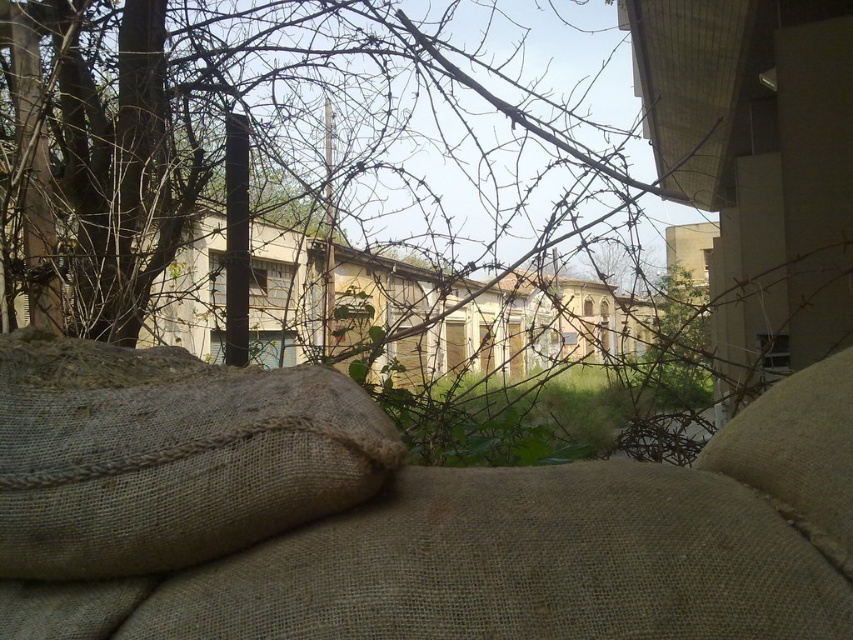
Is point (149, 81) behind point (44, 497)?

Yes, point (149, 81) is behind point (44, 497).

Between brown rough tree at upper left and burlap sack at lower left, which one is positioned lower?

burlap sack at lower left is below.

Is point (561, 104) positioned before point (135, 508)?

No, (561, 104) is further to viewer.

Where is `brown rough tree at upper left`? The width and height of the screenshot is (853, 640). brown rough tree at upper left is located at coordinates (322, 198).

Consider the image. Does burlap sack at lower center have a larger size compared to brown rough tree at upper left?

No, burlap sack at lower center is not bigger than brown rough tree at upper left.

Is point (244, 474) closer to camera compared to point (134, 198)?

That is True.

Describe the element at coordinates (393, 515) in the screenshot. I see `burlap sack at lower center` at that location.

This screenshot has height=640, width=853. What are the coordinates of `burlap sack at lower center` in the screenshot? It's located at (393, 515).

Does burlap sack at lower center appear on the right side of burlap pillow at center?

In fact, burlap sack at lower center is to the left of burlap pillow at center.

Is burlap sack at lower center taller than burlap pillow at center?

Yes, burlap sack at lower center is taller than burlap pillow at center.

What are the coordinates of `burlap sack at lower center` in the screenshot? It's located at (393, 515).

I want to click on burlap sack at lower center, so click(x=393, y=515).